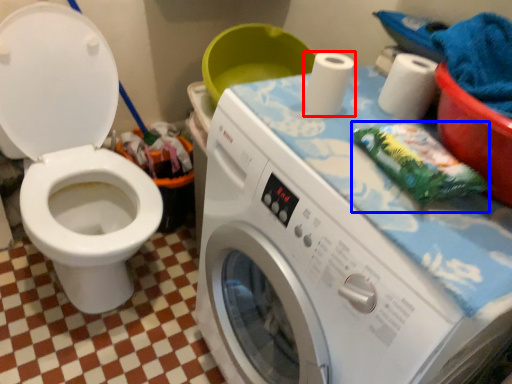
Question: Which point is further to the camera, toilet paper (highlighted by a red box) or material (highlighted by a blue box)?

Choices:
 (A) toilet paper
 (B) material

Answer: (A)